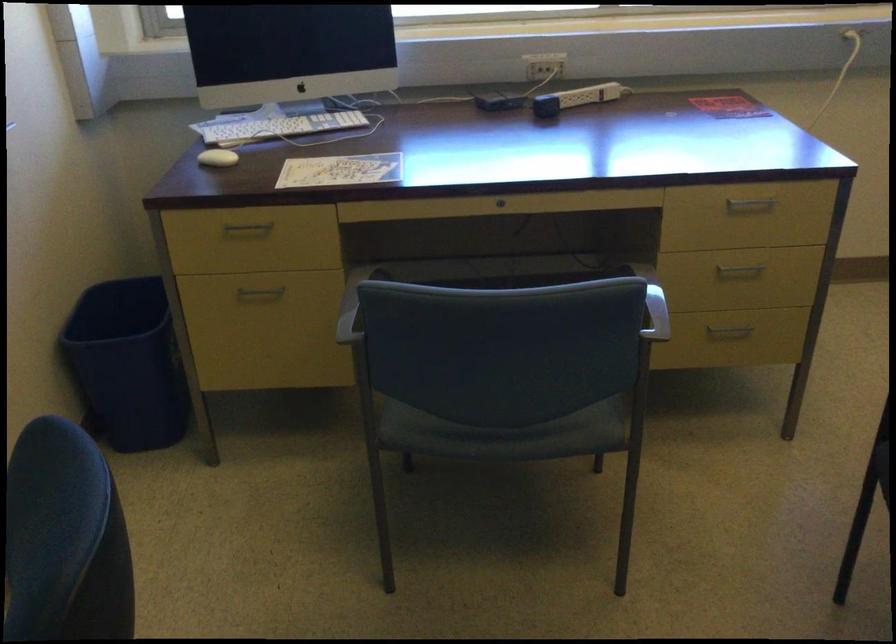
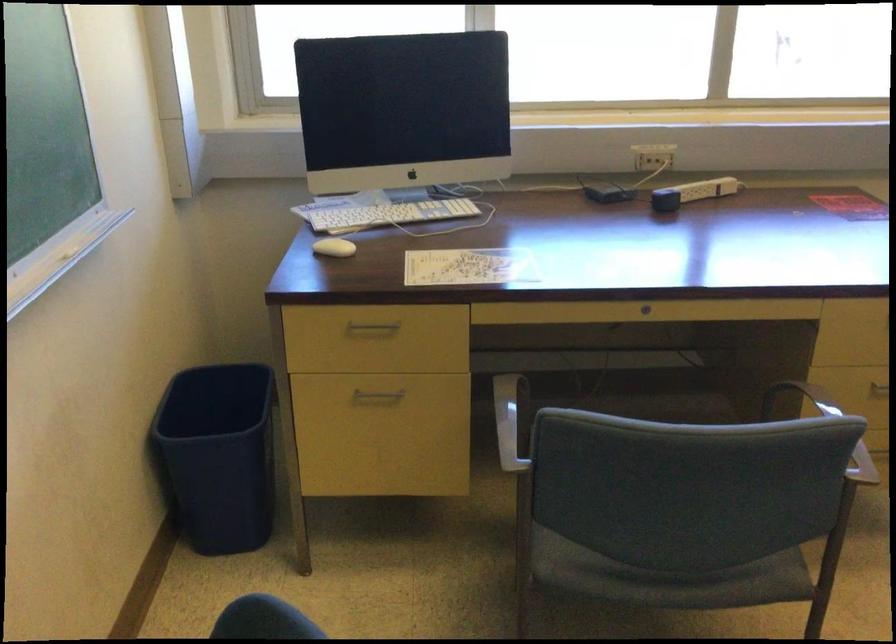
Find the pixel in the second image that matches (532,69) in the first image.

(643, 158)